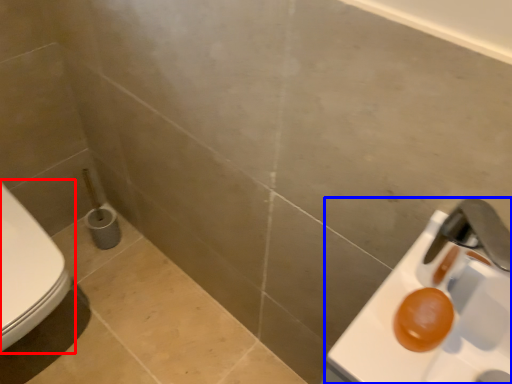
Question: Which object appears closest to the camera in this image, toilet (highlighted by a red box) or sink (highlighted by a blue box)?

Choices:
 (A) toilet
 (B) sink

Answer: (B)